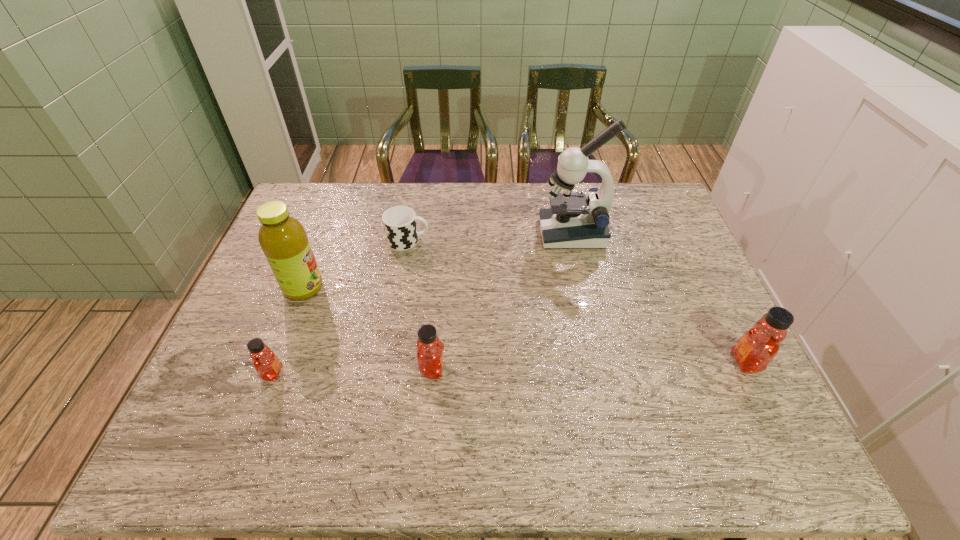
What are the coordinates of `object that is positioned at the far edge` in the screenshot? It's located at (573, 221).

At what (x,y) coordinates should I click in order to perform the action: click on honey situated at the left edge. Please return your answer as a coordinate pair (x, y). The image size is (960, 540). Looking at the image, I should click on (266, 363).

Where is `fruit juice located in the left edge section of the desktop`? fruit juice located in the left edge section of the desktop is located at coordinates (283, 239).

Locate an element on the screen. This screenshot has height=540, width=960. object at the right edge is located at coordinates (755, 349).

Find the location of a particular element. The width and height of the screenshot is (960, 540). object present at the near left corner is located at coordinates (266, 363).

Locate an element on the screen. The image size is (960, 540). vacant space at the far edge of the desktop is located at coordinates (526, 206).

This screenshot has width=960, height=540. In order to click on free space at the near edge of the desktop in this screenshot , I will do `click(322, 389)`.

This screenshot has width=960, height=540. I want to click on vacant space at the left edge, so click(x=237, y=369).

At what (x,y) coordinates should I click in order to perform the action: click on free space at the right edge. Please return your answer as a coordinate pair (x, y). The image size is (960, 540). Looking at the image, I should click on (693, 289).

In the image, there is a desktop. In order to click on vacant space at the near left corner in this screenshot , I will do `click(249, 406)`.